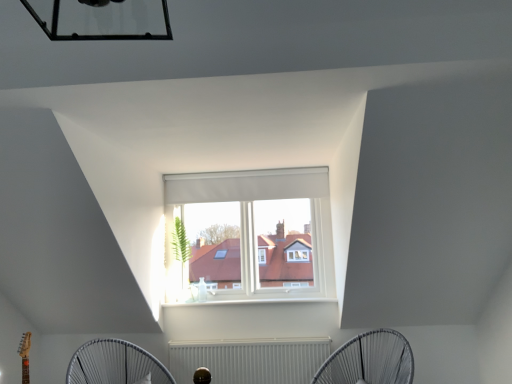
Question: Is white fabric mechanical fan at lower center, the first mechanical fan from the right, positioned far away from white textured radiator at lower center?

Choices:
 (A) no
 (B) yes

Answer: (A)

Question: Is the position of white fabric mechanical fan at lower center, the first mechanical fan from the right, more distant than that of white textured radiator at lower center?

Choices:
 (A) no
 (B) yes

Answer: (A)

Question: Is white textured radiator at lower center a part of white fabric mechanical fan at lower center, the second mechanical fan when ordered from left to right?

Choices:
 (A) yes
 (B) no

Answer: (B)

Question: Can you confirm if white fabric mechanical fan at lower center, the second mechanical fan when ordered from left to right, is positioned to the left of white textured radiator at lower center?

Choices:
 (A) yes
 (B) no

Answer: (B)

Question: Is white fabric mechanical fan at lower center, the first mechanical fan from the right, wider than white textured radiator at lower center?

Choices:
 (A) no
 (B) yes

Answer: (B)

Question: Would you say white textured radiator at lower center is inside or outside white wireframe fan at lower center, the second mechanical fan from the right?

Choices:
 (A) outside
 (B) inside

Answer: (A)

Question: In the image, is white textured radiator at lower center positioned in front of or behind white wireframe fan at lower center, marked as the 1th mechanical fan in a left-to-right arrangement?

Choices:
 (A) front
 (B) behind

Answer: (B)

Question: Is white textured radiator at lower center wider or thinner than white wireframe fan at lower center, the second mechanical fan from the right?

Choices:
 (A) thin
 (B) wide

Answer: (A)

Question: Based on their sizes in the image, would you say white textured radiator at lower center is bigger or smaller than white wireframe fan at lower center, marked as the 1th mechanical fan in a left-to-right arrangement?

Choices:
 (A) big
 (B) small

Answer: (B)

Question: Considering the positions of point (170, 340) and point (393, 332), is point (170, 340) closer or farther from the camera than point (393, 332)?

Choices:
 (A) closer
 (B) farther

Answer: (B)

Question: Based on their sizes in the image, would you say white textured radiator at lower center is bigger or smaller than white fabric mechanical fan at lower center, the first mechanical fan from the right?

Choices:
 (A) big
 (B) small

Answer: (B)

Question: From a real-world perspective, relative to white fabric mechanical fan at lower center, the second mechanical fan when ordered from left to right, is white textured radiator at lower center vertically above or below?

Choices:
 (A) above
 (B) below

Answer: (B)

Question: From the image's perspective, is white textured radiator at lower center located above or below white fabric mechanical fan at lower center, the first mechanical fan from the right?

Choices:
 (A) above
 (B) below

Answer: (B)

Question: Is white wireframe fan at lower center, marked as the 1th mechanical fan in a left-to-right arrangement, situated inside white textured radiator at lower center or outside?

Choices:
 (A) inside
 (B) outside

Answer: (B)

Question: From a real-world perspective, is white wireframe fan at lower center, marked as the 1th mechanical fan in a left-to-right arrangement, physically located above or below white textured radiator at lower center?

Choices:
 (A) below
 (B) above

Answer: (B)